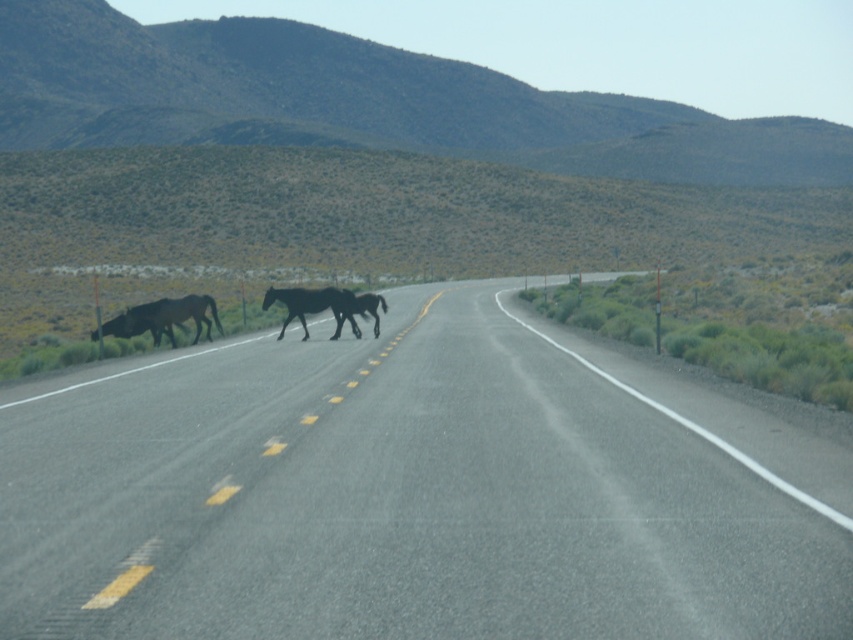
You are a driver approaching the road and see the dark brown horse at center and the black glossy horse at center. Which horse is closer to the ground?

The dark brown horse at center is positioned under the black glossy horse at center, so the dark brown horse at center is closer to the ground.

You are driving a car and see the image. There is a point marked at (415, 492) on the black asphalt highway at center. What is the significance of this point?

The point marked at (415, 492) on the black asphalt highway at center indicates the location where the road begins to curve slightly to the right, which drivers should be aware of for safe navigation.

You are driving a car and see the black asphalt highway at center and the dark brown horse at center. Which object is taller from your perspective?

The black asphalt highway at center is much taller than the dark brown horse at center.